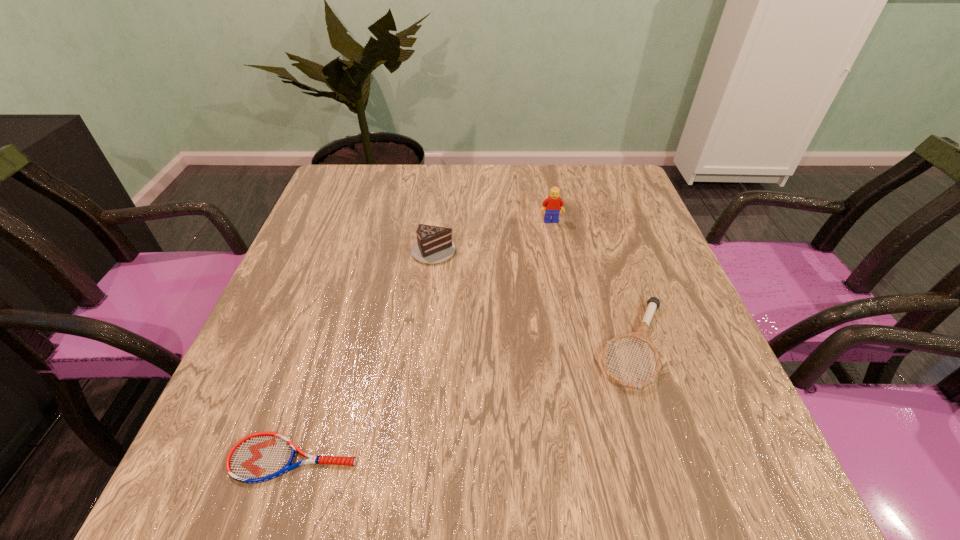
The image size is (960, 540). I want to click on free space located 0.160m on the front of the farther tennis racket, so click(681, 489).

Where is `free region located 0.360m on the back of the leftmost object`? This screenshot has height=540, width=960. free region located 0.360m on the back of the leftmost object is located at coordinates (348, 281).

This screenshot has width=960, height=540. I want to click on object located at the near edge, so click(259, 457).

The width and height of the screenshot is (960, 540). What are the coordinates of `object that is positioned at the left edge` in the screenshot? It's located at (259, 457).

Image resolution: width=960 pixels, height=540 pixels. Find the location of `object that is at the right edge`. object that is at the right edge is located at coordinates (641, 334).

Identify the location of object at the near left corner. The height and width of the screenshot is (540, 960). (259, 457).

I want to click on free space at the far edge, so click(x=540, y=199).

The height and width of the screenshot is (540, 960). Find the location of `vacant space at the near edge of the desktop`. vacant space at the near edge of the desktop is located at coordinates (591, 494).

Where is `free space at the left edge of the desktop`? The image size is (960, 540). free space at the left edge of the desktop is located at coordinates coord(326,312).

Locate an element on the screen. The image size is (960, 540). vacant space at the right edge of the desktop is located at coordinates (614, 222).